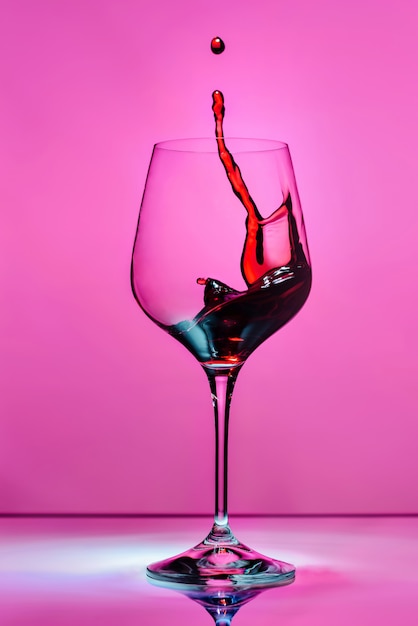
The height and width of the screenshot is (626, 418). I want to click on wine in glass, so click(271, 295).